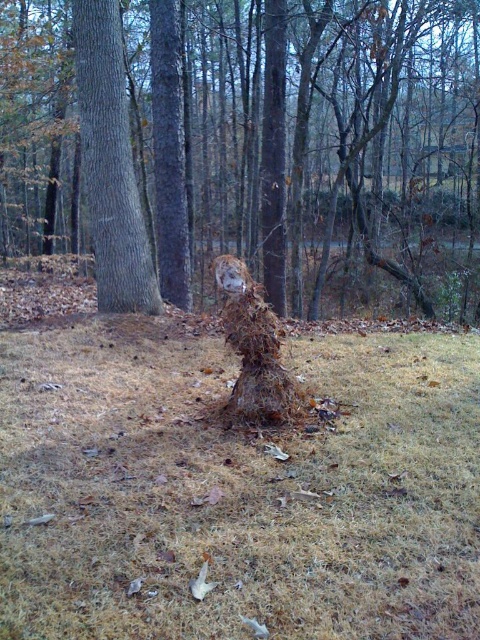
You are a hiker who needs to cross a wooded area. You see brown dry grass at center and a brown rough tree trunk at left. Which one would you choose to step on if you want to avoid sinking into soft ground?

The brown dry grass at center has a larger size compared to the brown rough tree trunk at left, so stepping on the brown rough tree trunk at left would be better to avoid sinking since it has a smaller size and likely firmer ground.

You are a gardener who needs to place a 30 inch wide decorative stone between the brown dry grass at center and the brown textured stump at center. Can you fit it between them without overlapping either object?

The distance between the brown dry grass at center and the brown textured stump at center is 32.57 inches. Since the decorative stone is 30 inches wide, it can fit between them as the space is slightly larger than the stone.

You are standing at the origin point of the image coordinate system, which is the bottom left corner. You want to walk to the brown dry grass at center. What direction should you move in?

You should move northeast to reach the brown dry grass at center because its 2D coordinates are at point (237, 490), which is northeast of the origin.